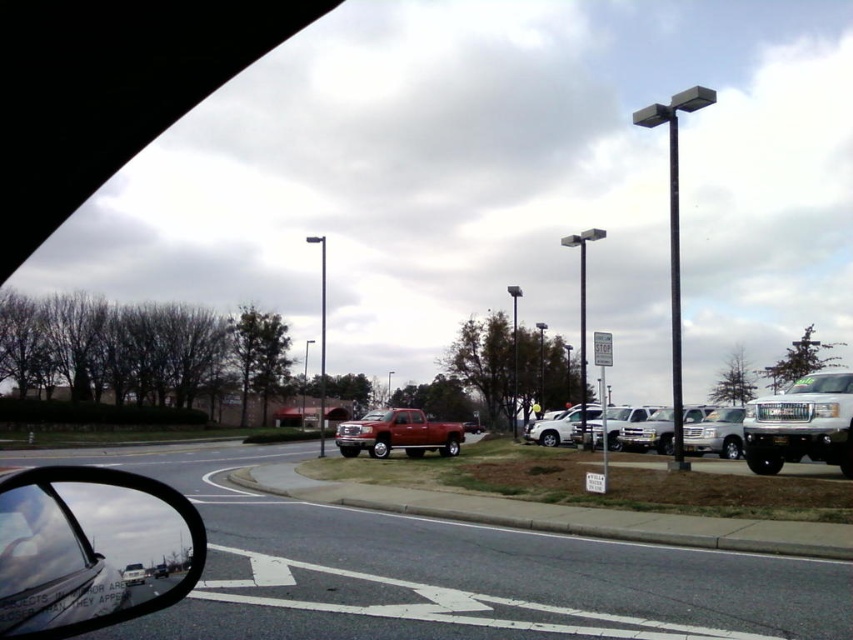
You are driving a car and looking through the windshield. You see two points marked on the road ahead. The first point is at coordinates point (717,442) and the second point is at point (544,435). Which point is closer to your current position?

Point (544,435) is closer to your current position because it is behind point (717,442). Since the point (717,442) is in front of point (544,435), the latter is nearer to your current position in the vehicle.

You are a delivery driver who needs to park your truck in this parking lot. You see a silver metallic suv at right and a satin silver suv at center. Which vehicle should you avoid if you want to park in a spot that requires lower height clearance?

The silver metallic suv at right is not as tall as satin silver suv at center, so you should avoid parking near the satin silver suv at center because it is taller and may require more height clearance.

You are a delivery driver who needs to park your 2.5 meters tall delivery van. You see the shiny red truck at center and the silver metallic suv at right in the parking lot. Which vehicle should you avoid parking next to if you want to ensure there is enough vertical clearance for your van?

The shiny red truck at center is taller than the silver metallic suv at right. Therefore, you should avoid parking next to the shiny red truck at center to ensure sufficient vertical clearance for your 2.5 meters tall delivery van.